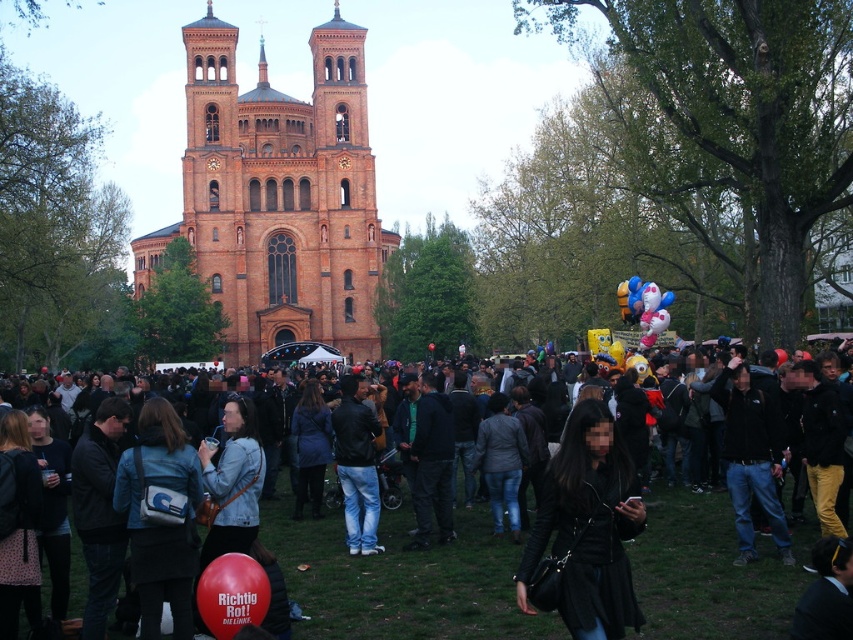
You are standing at the entrance of the church and see a black leather jacket at center. There is a blue umbrella at the edge of the crowd. How far apart are these two items?

The black leather jacket at center and the blue umbrella at the edge of the crowd are 114.62 meters apart.

You are a photographer standing at the edge of the crowd in front of the historic church. You want to capture a photo that includes both the black leather jacket at center and the rubber balloon at center. Given that your camera has a maximum zoom range of 30 meters, will you be able to include both objects in the same frame without moving closer?

The black leather jacket at center and the rubber balloon at center are 34.35 meters apart from each other. Since the camera can only zoom up to 30 meters, the distance between them exceeds the camera range. Therefore, you cannot include both objects in the same frame without moving closer.

You are standing at the entrance of the church and notice a person wearing a dark gray jacket at center. Where exactly is this jacket positioned relative to the church entrance?

The dark gray jacket at center is located at point 0.908 on the x axis and 0.471 on the y axis relative to the church entrance.